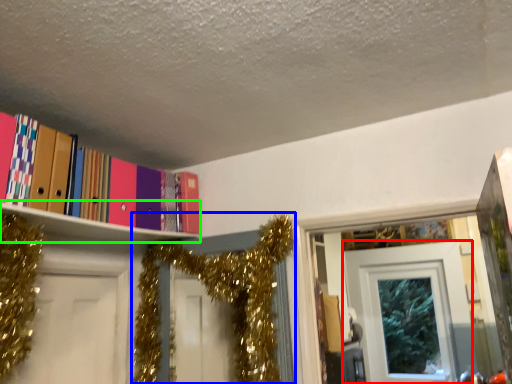
Question: Which is farther away from door (highlighted by a red box)? christmas decoration (highlighted by a blue box) or shelf (highlighted by a green box)?

Choices:
 (A) christmas decoration
 (B) shelf

Answer: (B)